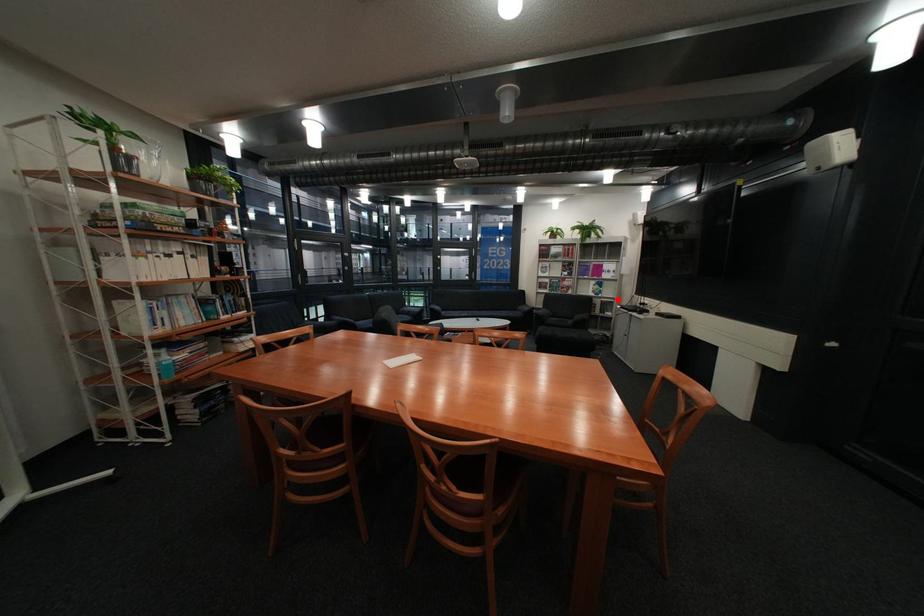
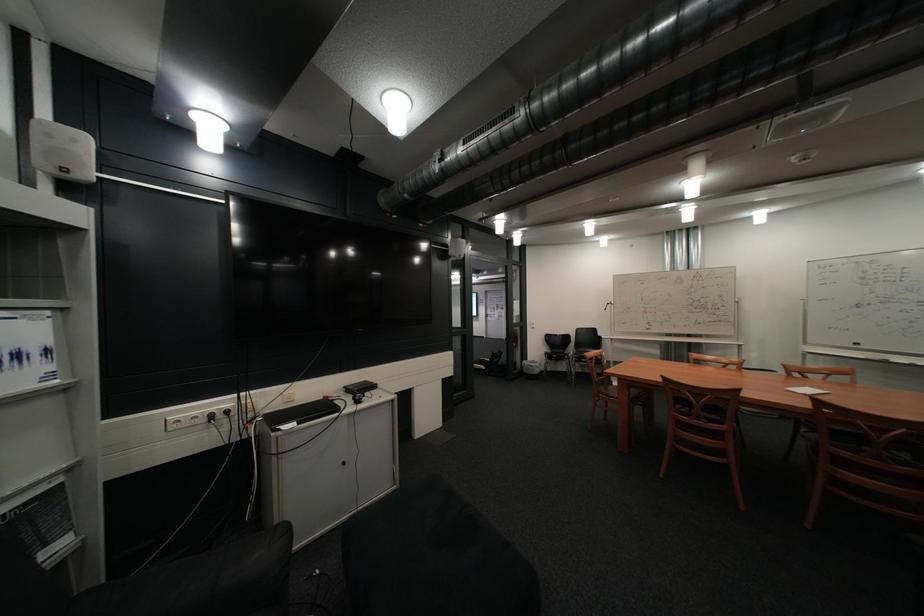
Find the pixel in the second image that matches the highlighted location in the first image.

(10, 514)